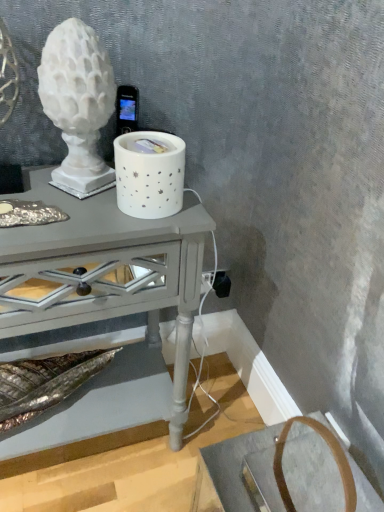
Identify the location of free space in front of white ceramic candle holder at center, the second candle holder viewed from the left. Image resolution: width=384 pixels, height=512 pixels. (113, 230).